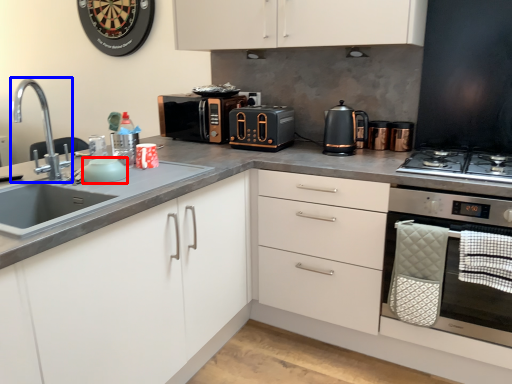
Question: Which of the following is the farthest to the observer, appliance (highlighted by a red box) or tap (highlighted by a blue box)?

Choices:
 (A) appliance
 (B) tap

Answer: (A)